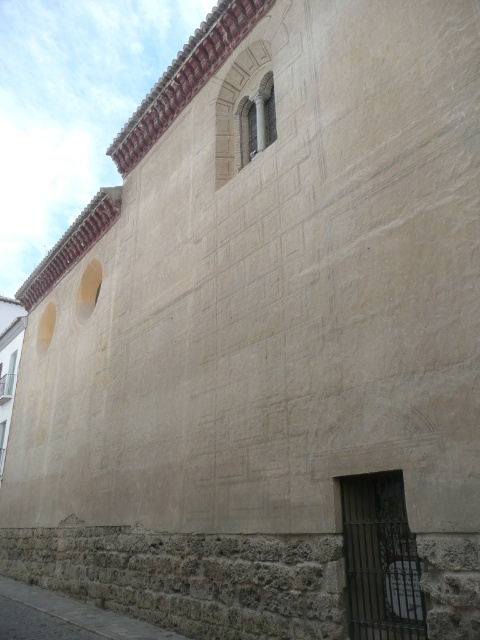
Looking at this image, you are an architect assessing the building facade. You need to install a new security camera. The camera must be placed at a height between the dark metal bars at lower right and the stone arched window at upper center. Can you confirm if there is enough vertical space to position the camera?

The dark metal bars at lower right has a lesser height compared to the stone arched window at upper center, so there is vertical space between them to position the camera.

You are an architect assessing the building facade. You notice the dark metal bars at lower right and the stone arched window at upper center. Which of these two elements has a larger size?

The dark metal bars at lower right is bigger than the stone arched window at upper center, so the dark metal bars at lower right has a larger size.